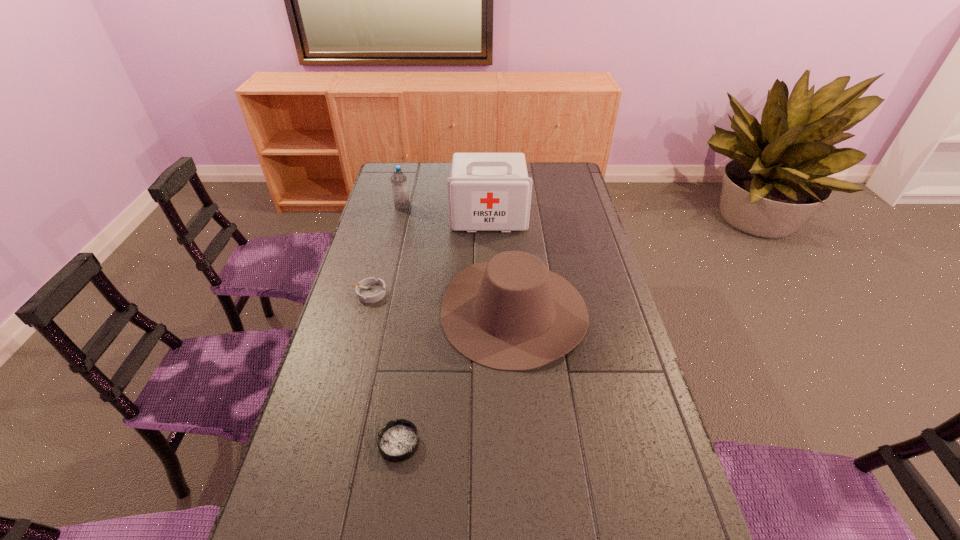
The image size is (960, 540). Identify the location of the tallest object. click(486, 191).

Identify the location of water bottle. (398, 179).

Locate an element on the screen. Image resolution: width=960 pixels, height=540 pixels. cowboy hat is located at coordinates (511, 313).

At what (x,y) coordinates should I click in order to perform the action: click on the left ashtray. Please return your answer as a coordinate pair (x, y). The width and height of the screenshot is (960, 540). Looking at the image, I should click on (369, 290).

The image size is (960, 540). Identify the location of the right ashtray. (397, 441).

What are the coordinates of `the nearer ashtray` in the screenshot? It's located at (397, 441).

What are the coordinates of `vacant position located on the front-facing side of the first-aid kit` in the screenshot? It's located at (490, 247).

The width and height of the screenshot is (960, 540). Find the location of `free space located on the front of the water bottle`. free space located on the front of the water bottle is located at coordinates (388, 266).

I want to click on free spot located on the right of the cowboy hat, so click(622, 311).

Image resolution: width=960 pixels, height=540 pixels. I want to click on vacant space situated 0.130m on the right of the left ashtray, so click(425, 293).